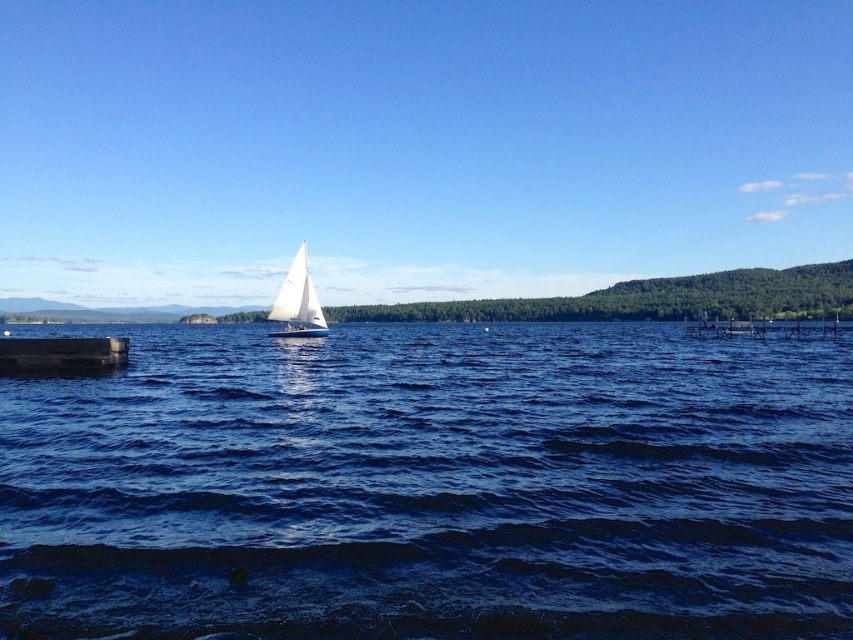
At what (x,y) coordinates should I click in order to perform the action: click on dark gray concrete dock at lower left. Please return your answer as a coordinate pair (x, y). The width and height of the screenshot is (853, 640). Looking at the image, I should click on (61, 355).

Does dark gray concrete dock at lower left have a smaller size compared to white matte sailboat at center?

Correct, dark gray concrete dock at lower left occupies less space than white matte sailboat at center.

Is point (88, 355) in front of point (296, 312)?

Yes, point (88, 355) is closer to viewer.

Locate an element on the screen. The image size is (853, 640). dark gray concrete dock at lower left is located at coordinates (61, 355).

Which is more to the right, blue water at center or dark gray concrete dock at lower left?

From the viewer's perspective, blue water at center appears more on the right side.

Is blue water at center closer to camera compared to dark gray concrete dock at lower left?

Yes, it is in front of dark gray concrete dock at lower left.

Which is behind, point (662, 426) or point (0, 372)?

The point (0, 372) is behind.

Find the location of a particular element. Image resolution: width=853 pixels, height=640 pixels. blue water at center is located at coordinates (432, 486).

Is point (28, 388) more distant than point (300, 282)?

No, it is in front of (300, 282).

Which is behind, point (70, 524) or point (282, 310)?

The point (282, 310) is more distant.

Find the location of a particular element. Image resolution: width=853 pixels, height=640 pixels. blue water at center is located at coordinates (432, 486).